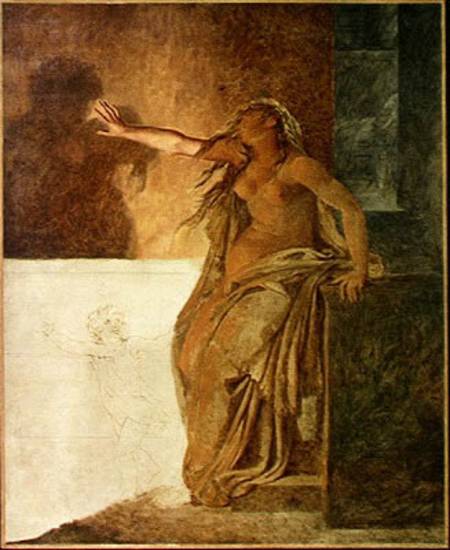
You are a GUI agent. You are given a task and a screenshot of the screen. Output one action in this format:
    pyautogui.click(x=<x>, y=<y>)
    Task: Click on the lower white wall
    
    Given the screenshot: What is the action you would take?
    pyautogui.click(x=33, y=386), pyautogui.click(x=76, y=414), pyautogui.click(x=54, y=283)